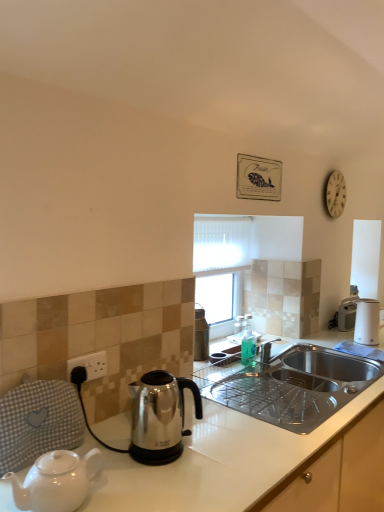
Find the location of a particular element. white glossy toaster at right is located at coordinates (367, 322).

The width and height of the screenshot is (384, 512). What do you see at coordinates (56, 481) in the screenshot?
I see `satin silver kettle at left, marked as the 2th kettle in a back-to-front arrangement` at bounding box center [56, 481].

Describe the element at coordinates (348, 310) in the screenshot. I see `white plastic coffee maker at right` at that location.

The height and width of the screenshot is (512, 384). What are the coordinates of `white fabric at center` in the screenshot? It's located at (222, 260).

Measure the distance between white glossy countertop at lower right and camera.

white glossy countertop at lower right is 4.64 feet away from camera.

Find the location of a particular element. gray checkered blanket at lower left is located at coordinates (38, 422).

What do you see at coordinates (88, 367) in the screenshot? This screenshot has height=512, width=384. I see `black plastic power outlet at lower left` at bounding box center [88, 367].

Find the location of a particular element. white glossy toaster at right is located at coordinates (367, 322).

Based on the photo, is gray checkered blanket at lower left not inside stainless steel kettle at center, which is the second kettle from front to back?

gray checkered blanket at lower left lies outside stainless steel kettle at center, which is the second kettle from front to back,'s area.

Looking at their sizes, would you say gray checkered blanket at lower left is wider or thinner than stainless steel kettle at center, which ranks as the 1th kettle in back-to-front order?

Considering their sizes, gray checkered blanket at lower left looks slimmer than stainless steel kettle at center, which ranks as the 1th kettle in back-to-front order.

Which is more to the left, gray checkered blanket at lower left or stainless steel kettle at center, which is the 2th kettle in left-to-right order?

gray checkered blanket at lower left.

Considering the relative sizes of satin silver kettle at left, marked as the 2th kettle in a back-to-front arrangement, and white fabric at center in the image provided, is satin silver kettle at left, marked as the 2th kettle in a back-to-front arrangement, bigger than white fabric at center?

Actually, satin silver kettle at left, marked as the 2th kettle in a back-to-front arrangement, might be smaller than white fabric at center.

From the image's perspective, which is above, satin silver kettle at left, which appears as the 1th kettle when viewed from the left, or white fabric at center?

white fabric at center appears higher in the image.

Is white plastic coffee maker at right inside the boundaries of white glossy toaster at right, or outside?

The correct answer is: outside.

Between white plastic coffee maker at right and white glossy toaster at right, which one has larger size?

white plastic coffee maker at right.

The image size is (384, 512). I want to click on toaster above the white plastic coffee maker at right (from a real-world perspective), so click(x=367, y=322).

From the image's perspective, is gray checkered blanket at lower left over white plastic coffee maker at right?

No, from the image's perspective, gray checkered blanket at lower left is not above white plastic coffee maker at right.

Can you confirm if gray checkered blanket at lower left is positioned to the left of white plastic coffee maker at right?

Indeed, gray checkered blanket at lower left is positioned on the left side of white plastic coffee maker at right.

Choose the correct answer: Is gray checkered blanket at lower left inside white plastic coffee maker at right or outside it?

gray checkered blanket at lower left lies outside white plastic coffee maker at right.

Between point (4, 441) and point (344, 310), which one is positioned in front?

The point (4, 441) is closer.

From a real-world perspective, is white fabric at center located higher than gray checkered blanket at lower left?

Correct, in the physical world, white fabric at center is higher than gray checkered blanket at lower left.

Which of these two, white fabric at center or gray checkered blanket at lower left, is smaller?

gray checkered blanket at lower left.

In the scene shown: Is white fabric at center aimed at gray checkered blanket at lower left?

No, white fabric at center is not aimed at gray checkered blanket at lower left.

Considering the relative sizes of white plastic coffee maker at right and white glossy countertop at lower right in the image provided, is white plastic coffee maker at right thinner than white glossy countertop at lower right?

Correct, the width of white plastic coffee maker at right is less than that of white glossy countertop at lower right.

Is white plastic coffee maker at right in front of or behind white glossy countertop at lower right in the image?

white plastic coffee maker at right is behind white glossy countertop at lower right.

In the scene shown: Is white plastic coffee maker at right far away from white glossy countertop at lower right?

white plastic coffee maker at right is near white glossy countertop at lower right, not far away.

Which object is positioned more to the right, white plastic coffee maker at right or white glossy countertop at lower right?

white plastic coffee maker at right is more to the right.

Is black plastic power outlet at lower left at the left side of white wooden clock at upper right?

Correct, you'll find black plastic power outlet at lower left to the left of white wooden clock at upper right.

Is black plastic power outlet at lower left smaller than white wooden clock at upper right?

Correct, black plastic power outlet at lower left occupies less space than white wooden clock at upper right.

From the picture: Is black plastic power outlet at lower left spatially inside white wooden clock at upper right, or outside of it?

black plastic power outlet at lower left is outside white wooden clock at upper right.

Does black plastic power outlet at lower left touch white wooden clock at upper right?

black plastic power outlet at lower left and white wooden clock at upper right are not in contact.

Where is `kettle that appears behind the gray checkered blanket at lower left`? This screenshot has width=384, height=512. kettle that appears behind the gray checkered blanket at lower left is located at coordinates (160, 416).

I want to click on window screen on the right of satin silver kettle at left, the first kettle when ordered from front to back, so click(x=222, y=260).

Based on their spatial positions, is white glossy countertop at lower right or stainless steel kettle at center, which is the 2th kettle in left-to-right order, further from white glossy toaster at right?

Among the two, stainless steel kettle at center, which is the 2th kettle in left-to-right order, is located further to white glossy toaster at right.

Which object lies nearer to the anchor point white glossy toaster at right, gray checkered blanket at lower left or white wooden clock at upper right?

The object closer to white glossy toaster at right is white wooden clock at upper right.

When comparing their distances from stainless steel kettle at center, which ranks as the 1th kettle in back-to-front order, does satin silver kettle at left, the first kettle when ordered from front to back, or white glossy countertop at lower right seem further?

white glossy countertop at lower right is further to stainless steel kettle at center, which ranks as the 1th kettle in back-to-front order.

Based on their spatial positions, is white fabric at center or black plastic power outlet at lower left closer to white plastic coffee maker at right?

white fabric at center is closer to white plastic coffee maker at right.

From the image, which object appears to be nearer to black plastic power outlet at lower left, white glossy countertop at lower right or white glossy toaster at right?

white glossy countertop at lower right.

Considering their positions, is white glossy countertop at lower right positioned closer to black plastic power outlet at lower left than white wooden clock at upper right?

white glossy countertop at lower right is closer to black plastic power outlet at lower left.

When comparing their distances from gray checkered blanket at lower left, does white glossy toaster at right or white wooden clock at upper right seem further?

white glossy toaster at right.

When comparing their distances from white plastic coffee maker at right, does white fabric at center or satin silver kettle at left, marked as the second kettle in a right-to-left arrangement, seem closer?

white fabric at center.

Image resolution: width=384 pixels, height=512 pixels. I want to click on countertop located between stainless steel kettle at center, which is the second kettle from front to back, and white wooden clock at upper right in the depth direction, so click(x=290, y=385).

You are a GUI agent. You are given a task and a screenshot of the screen. Output one action in this format:
    pyautogui.click(x=<x>, y=<y>)
    Task: Click on the clock between gray checkered blanket at lower left and white glossy toaster at right from left to right
    The width and height of the screenshot is (384, 512).
    Given the screenshot: What is the action you would take?
    pyautogui.click(x=335, y=194)

Locate an element on the screen. The height and width of the screenshot is (512, 384). countertop between satin silver kettle at left, the first kettle when ordered from front to back, and white plastic coffee maker at right, along the z-axis is located at coordinates (290, 385).

What are the coordinates of `clock situated between white fabric at center and white glossy toaster at right from left to right` in the screenshot? It's located at (335, 194).